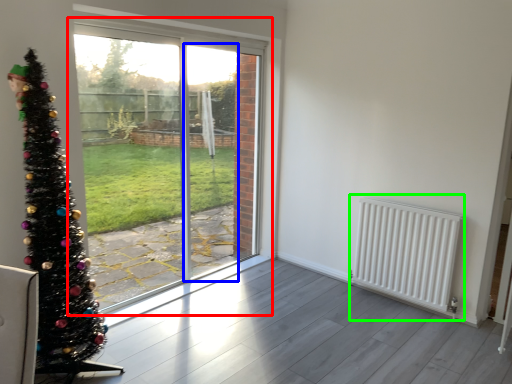
Question: Which object is the closest to the window (highlighted by a red box)? Choose among these: screen door (highlighted by a blue box) or radiator (highlighted by a green box).

Choices:
 (A) screen door
 (B) radiator

Answer: (A)